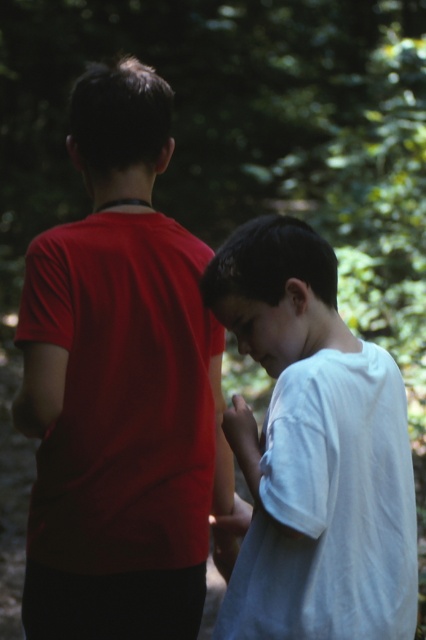
Question: Does matte red t-shirt at left have a lesser width compared to white cotton shirt at right?

Choices:
 (A) yes
 (B) no

Answer: (B)

Question: Which of the following is the farthest from the observer?

Choices:
 (A) (155, 605)
 (B) (414, 628)

Answer: (A)

Question: Among these objects, which one is farthest from the camera?

Choices:
 (A) white cotton shirt at right
 (B) matte red t-shirt at left

Answer: (B)

Question: Can you confirm if matte red t-shirt at left is bigger than white cotton shirt at right?

Choices:
 (A) no
 (B) yes

Answer: (B)

Question: Does matte red t-shirt at left appear on the left side of white cotton shirt at right?

Choices:
 (A) no
 (B) yes

Answer: (B)

Question: Which of the following is the farthest from the observer?

Choices:
 (A) matte red t-shirt at left
 (B) white cotton shirt at right

Answer: (A)